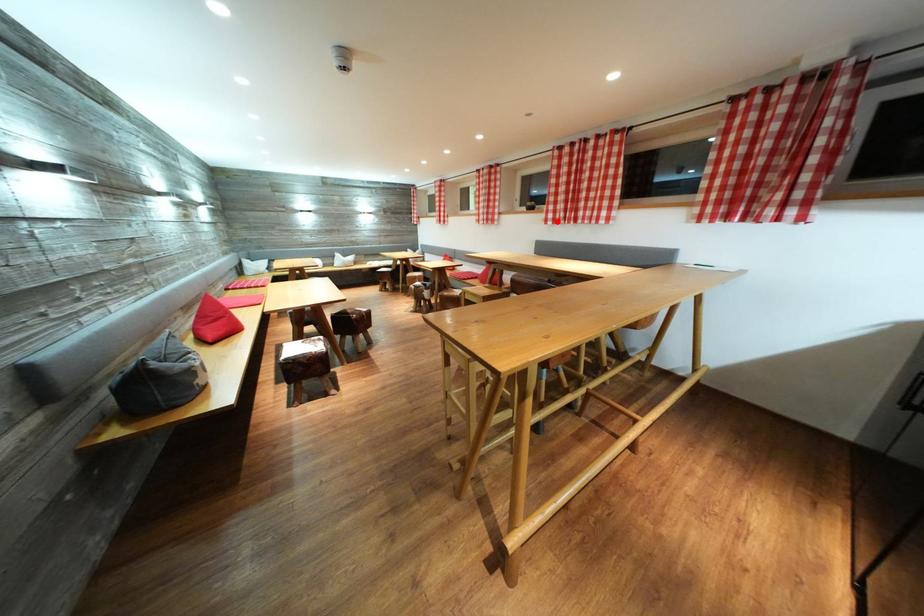
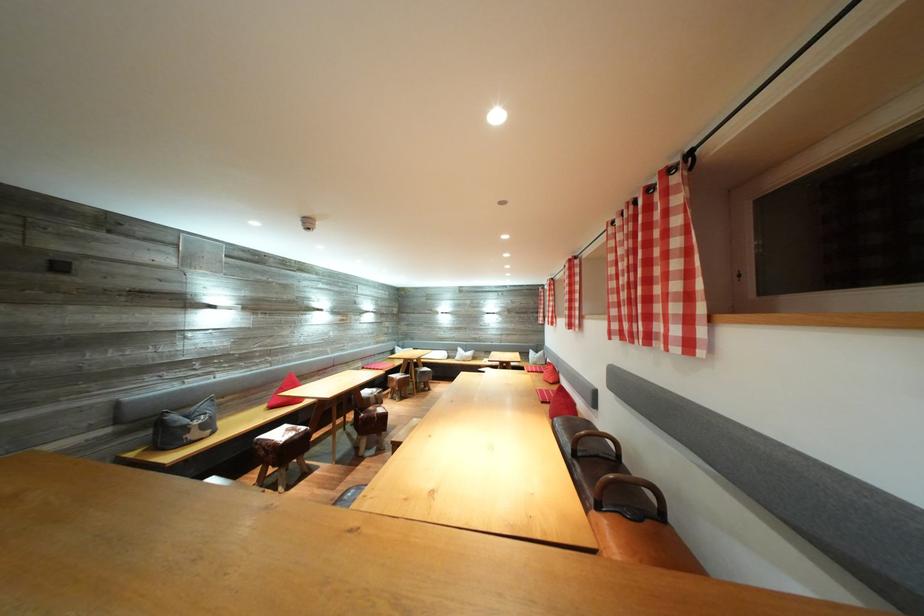
In the second image, find the point that corresponds to the highlighted location in the first image.

(622, 331)